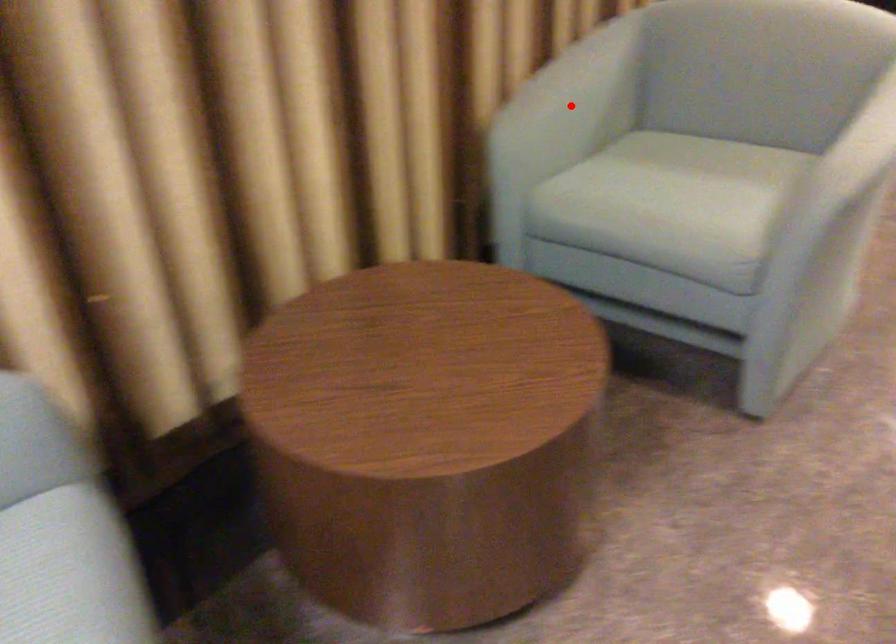
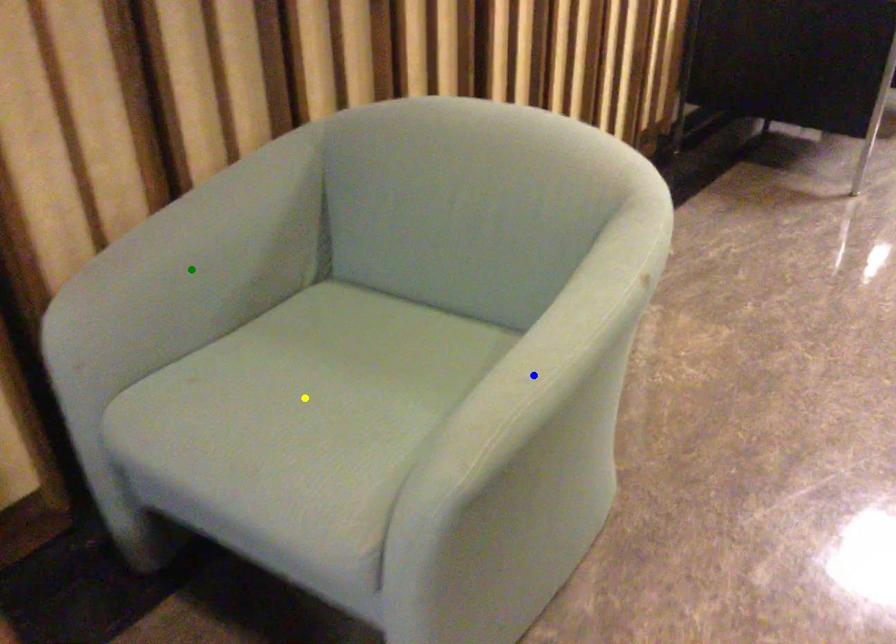
Question: I am providing you with two images of the same scene from different viewpoints. A red point is marked on the first image. You are given multiple points on the second image. Which point in image 2 is actually the same real-world point as the red point in image 1?

Choices:
 (A) blue point
 (B) green point
 (C) yellow point

Answer: (B)